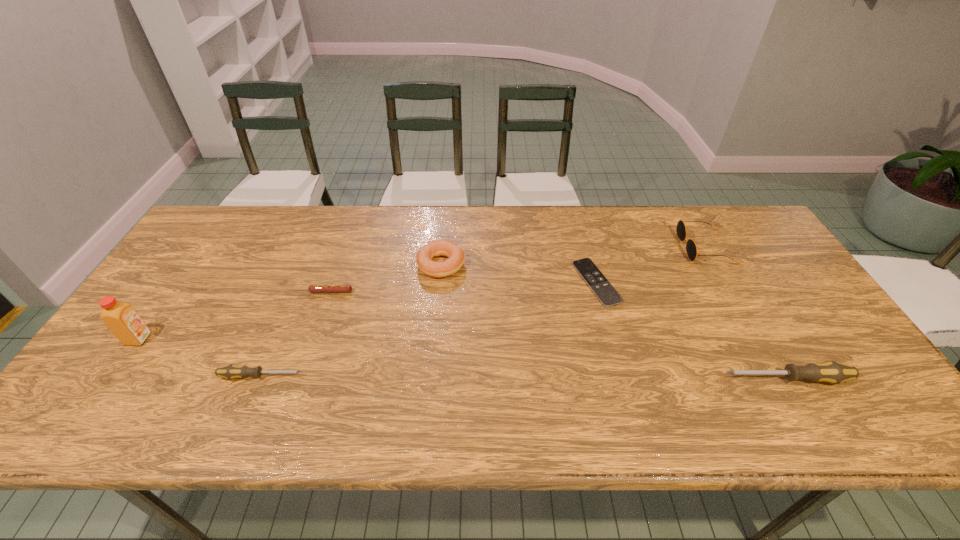
The image size is (960, 540). What are the coordinates of `free point between the fifth object from left to right and the tallest object` in the screenshot? It's located at (368, 311).

This screenshot has width=960, height=540. What are the coordinates of `free space between the sunglasses and the right screwdriver` in the screenshot? It's located at (745, 313).

The height and width of the screenshot is (540, 960). Find the location of `empty space between the shortest object and the left screwdriver`. empty space between the shortest object and the left screwdriver is located at coordinates (429, 329).

Identify the location of free space between the fourth object from right to left and the sunglasses. (573, 256).

In order to click on the third closest object to the bagel in this screenshot , I will do `click(232, 371)`.

Choose which object is the nearest neighbor to the sixth tallest object. Please provide its 2D coordinates. Your answer should be formatted as a tuple, i.e. [(x, y)], where the tuple contains the x and y coordinates of a point satisfying the conditions above.

[(455, 254)]

The width and height of the screenshot is (960, 540). In order to click on blank area in the image that satisfies the following two spatial constraints: 1. on the front-facing side of the sunglasses; 2. on the front side of the third object from right to left in this screenshot , I will do `click(725, 282)`.